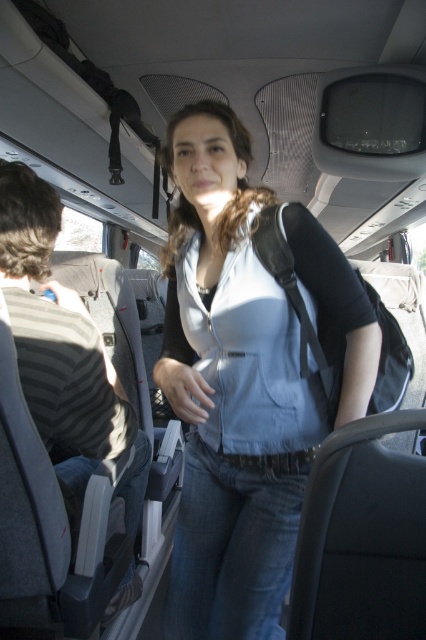
Who is higher up, matte blue jacket at center or striped fabric shirt at left?

matte blue jacket at center is higher up.

This screenshot has height=640, width=426. Describe the element at coordinates (230, 392) in the screenshot. I see `matte blue jacket at center` at that location.

Is point (212, 102) more distant than point (40, 317)?

No.

Find the location of a particular element. This screenshot has height=640, width=426. matte blue jacket at center is located at coordinates (230, 392).